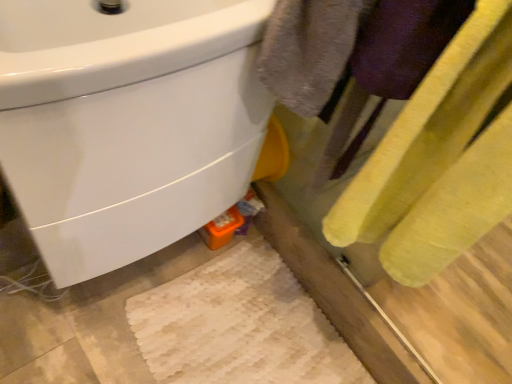
Question: Is yellow fabric towel at right at the back of white glossy sink at upper left?

Choices:
 (A) yes
 (B) no

Answer: (B)

Question: Is white glossy sink at upper left outside of yellow fabric towel at right?

Choices:
 (A) no
 (B) yes

Answer: (B)

Question: Does white glossy sink at upper left appear on the left side of yellow fabric towel at right?

Choices:
 (A) no
 (B) yes

Answer: (B)

Question: Can you confirm if white glossy sink at upper left is smaller than yellow fabric towel at right?

Choices:
 (A) no
 (B) yes

Answer: (A)

Question: Does white glossy sink at upper left have a lesser height compared to yellow fabric towel at right?

Choices:
 (A) yes
 (B) no

Answer: (A)

Question: From a real-world perspective, is white glossy sink at upper left on top of yellow fabric towel at right?

Choices:
 (A) yes
 (B) no

Answer: (B)

Question: Is yellow fabric towel at right located outside white glossy sink at upper left?

Choices:
 (A) yes
 (B) no

Answer: (A)

Question: From a real-world perspective, is yellow fabric towel at right on top of white glossy sink at upper left?

Choices:
 (A) yes
 (B) no

Answer: (A)

Question: Could white glossy sink at upper left be considered to be inside yellow fabric towel at right?

Choices:
 (A) yes
 (B) no

Answer: (B)

Question: Considering the relative positions of yellow fabric towel at right and white glossy sink at upper left in the image provided, is yellow fabric towel at right behind white glossy sink at upper left?

Choices:
 (A) no
 (B) yes

Answer: (A)

Question: Does yellow fabric towel at right have a greater height compared to white glossy sink at upper left?

Choices:
 (A) no
 (B) yes

Answer: (B)

Question: Is yellow fabric towel at right wider than white glossy sink at upper left?

Choices:
 (A) yes
 (B) no

Answer: (B)

Question: Is white glossy sink at upper left in front of or behind yellow fabric towel at right in the image?

Choices:
 (A) behind
 (B) front

Answer: (A)